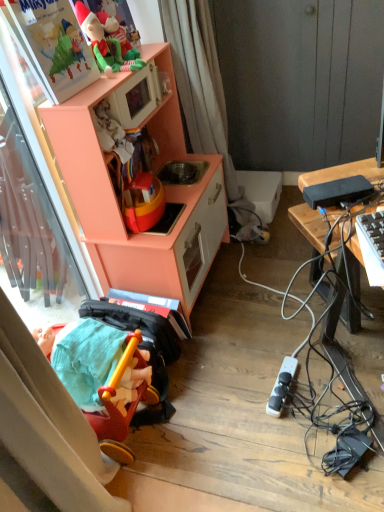
This screenshot has height=512, width=384. Describe the element at coordinates (199, 81) in the screenshot. I see `white fabric curtain at upper center` at that location.

Measure the distance between rubberized red tricycle at lower left, the 1th toy when ordered from bottom to top, and camera.

rubberized red tricycle at lower left, the 1th toy when ordered from bottom to top, is 3.82 feet away from camera.

The height and width of the screenshot is (512, 384). Describe the element at coordinates (118, 196) in the screenshot. I see `peach wood toy kitchen at left` at that location.

What is the approximate height of matte plastic elf at upper left, the 2th toy ordered from the bottom?

matte plastic elf at upper left, the 2th toy ordered from the bottom, is 14.09 inches in height.

You are a GUI agent. You are given a task and a screenshot of the screen. Output one action in this format:
    pyautogui.click(x=<x>, y=<y>)
    Task: Click on the white fabric curtain at upper center
    
    Given the screenshot: What is the action you would take?
    pyautogui.click(x=199, y=81)

Which of these two, rubberized red tricycle at lower left, the 2th toy viewed from the top, or black plastic desk at right, is wider?

Wider between the two is black plastic desk at right.

In terms of height, does rubberized red tricycle at lower left, the 1th toy when ordered from bottom to top, look taller or shorter compared to black plastic desk at right?

In the image, rubberized red tricycle at lower left, the 1th toy when ordered from bottom to top, appears to be taller than black plastic desk at right.

Find the location of a particular element. The image size is (384, 512). desk on the right of the rubberized red tricycle at lower left, the 2th toy viewed from the top is located at coordinates (337, 323).

In the scene shown: How many degrees apart are the facing directions of rubberized red tricycle at lower left, the 2th toy viewed from the top, and black plastic desk at right?

56.7 degrees.

In the scene shown: From a real-world perspective, between black plastic power strip at lower right, positioned as the 1th appliance in bottom-to-top order, and rubberized red tricycle at lower left, the 1th toy when ordered from bottom to top, who is vertically lower?

black plastic power strip at lower right, positioned as the 1th appliance in bottom-to-top order.

Is black plastic power strip at lower right, positioned as the 1th appliance in bottom-to-top order, not near rubberized red tricycle at lower left, the 1th toy when ordered from bottom to top?

That's not correct — black plastic power strip at lower right, positioned as the 1th appliance in bottom-to-top order, is a little close to rubberized red tricycle at lower left, the 1th toy when ordered from bottom to top.

Can you confirm if black plastic power strip at lower right, acting as the 2th appliance starting from the top, is wider than rubberized red tricycle at lower left, the 2th toy viewed from the top?

Incorrect, the width of black plastic power strip at lower right, acting as the 2th appliance starting from the top, does not surpass that of rubberized red tricycle at lower left, the 2th toy viewed from the top.

From the image's perspective, between black plastic power strip at lower right, acting as the 1th appliance starting from the back, and rubberized red tricycle at lower left, the 2th toy viewed from the top, which one is located above?

From the image's view, rubberized red tricycle at lower left, the 2th toy viewed from the top, is above.

Is peach wood toy kitchen at left bigger than black plastic desk at right?

Correct, peach wood toy kitchen at left is larger in size than black plastic desk at right.

Can you confirm if peach wood toy kitchen at left is wider than black plastic desk at right?

Yes, peach wood toy kitchen at left is wider than black plastic desk at right.

From the picture: From a real-world perspective, which object rests below the other?

black plastic desk at right.

Based on the photo, from the image's perspective, is peach wood toy kitchen at left above white fabric curtain at upper center?

No.

How much distance is there between peach wood toy kitchen at left and white fabric curtain at upper center?

They are 33.93 centimeters apart.

Between peach wood toy kitchen at left and white fabric curtain at upper center, which one has larger size?

With larger size is peach wood toy kitchen at left.

Which object is closer to the camera, peach wood toy kitchen at left or white fabric curtain at upper center?

peach wood toy kitchen at left is more forward.

Is black plastic desk at right not inside black plastic power strip at lower right, acting as the 2th appliance starting from the front?

Yes, black plastic desk at right is outside of black plastic power strip at lower right, acting as the 2th appliance starting from the front.

Can you confirm if black plastic desk at right is wider than black plastic power strip at lower right, positioned as the 1th appliance in bottom-to-top order?

Yes, black plastic desk at right is wider than black plastic power strip at lower right, positioned as the 1th appliance in bottom-to-top order.

Is black plastic desk at right at the left side of black plastic power strip at lower right, acting as the 2th appliance starting from the top?

Incorrect, black plastic desk at right is not on the left side of black plastic power strip at lower right, acting as the 2th appliance starting from the top.

From a real-world perspective, is black plastic desk at right positioned above or below black plastic power strip at lower right, positioned as the 1th appliance in bottom-to-top order?

black plastic desk at right is above black plastic power strip at lower right, positioned as the 1th appliance in bottom-to-top order.

From the picture: Is black plastic power strip at lower right, acting as the 1th appliance starting from the back, in contact with matte plastic elf at upper left, which is counted as the 1th toy, starting from the top?

No, black plastic power strip at lower right, acting as the 1th appliance starting from the back, is not in contact with matte plastic elf at upper left, which is counted as the 1th toy, starting from the top.

Is black plastic power strip at lower right, acting as the 2th appliance starting from the top, bigger than matte plastic elf at upper left, which is counted as the 1th toy, starting from the top?

No.

From the matte plastic elf at upper left, which is counted as the 1th toy, starting from the top, count 1st appliance to the right and point to it. Please provide its 2D coordinates.

[(282, 386)]

Is black plastic power strip at lower right, acting as the 2th appliance starting from the front, facing away from matte plastic elf at upper left, the 2th toy ordered from the bottom?

black plastic power strip at lower right, acting as the 2th appliance starting from the front, does not have its back to matte plastic elf at upper left, the 2th toy ordered from the bottom.

Who is more distant, black plastic power bank at right, the second appliance when ordered from back to front, or white fabric curtain at upper center?

white fabric curtain at upper center is further away from the camera.

This screenshot has width=384, height=512. What are the coordinates of `the 2nd appliance in front of the white fabric curtain at upper center` in the screenshot? It's located at (337, 192).

Could you measure the distance between black plastic power bank at right, the first appliance positioned from the front, and white fabric curtain at upper center?

The distance of black plastic power bank at right, the first appliance positioned from the front, from white fabric curtain at upper center is 91.49 centimeters.

At what (x,y) coordinates should I click in order to perform the action: click on desk that appears behind the rubberized red tricycle at lower left, the 1th toy when ordered from bottom to top. Please return your answer as a coordinate pair (x, y). The height and width of the screenshot is (512, 384). Looking at the image, I should click on (337, 323).

Image resolution: width=384 pixels, height=512 pixels. In order to click on the 1st toy counting from the left of the black plastic power strip at lower right, acting as the 2th appliance starting from the top in this screenshot , I will do `click(118, 408)`.

From the image, which object appears to be farther from white fabric curtain at upper center, matte plastic elf at upper left, which is counted as the 1th toy, starting from the top, or peach wood toy kitchen at left?

Among the two, matte plastic elf at upper left, which is counted as the 1th toy, starting from the top, is located further to white fabric curtain at upper center.

Considering their positions, is peach wood toy kitchen at left positioned further to white fabric curtain at upper center than rubberized red tricycle at lower left, the 1th toy when ordered from bottom to top?

rubberized red tricycle at lower left, the 1th toy when ordered from bottom to top, is further to white fabric curtain at upper center.

Which object lies nearer to the anchor point black plastic power bank at right, the first appliance positioned from the front, black plastic desk at right or black plastic power strip at lower right, acting as the 2th appliance starting from the top?

The object closer to black plastic power bank at right, the first appliance positioned from the front, is black plastic desk at right.

Based on their spatial positions, is black plastic desk at right or black plastic power bank at right, the second appliance when ordered from back to front, further from black plastic power strip at lower right, acting as the 2th appliance starting from the top?

Based on the image, black plastic power bank at right, the second appliance when ordered from back to front, appears to be further to black plastic power strip at lower right, acting as the 2th appliance starting from the top.

Looking at the image, which one is located further to matte plastic elf at upper left, the 2th toy ordered from the bottom, black plastic power strip at lower right, positioned as the 1th appliance in bottom-to-top order, or rubberized red tricycle at lower left, the 1th toy when ordered from bottom to top?

black plastic power strip at lower right, positioned as the 1th appliance in bottom-to-top order, is positioned further to the anchor matte plastic elf at upper left, the 2th toy ordered from the bottom.

From the image, which object appears to be farther from peach wood toy kitchen at left, black plastic power bank at right, the first appliance in the top-to-bottom sequence, or white fabric curtain at upper center?

black plastic power bank at right, the first appliance in the top-to-bottom sequence, is positioned further to the anchor peach wood toy kitchen at left.

When comparing their distances from matte plastic elf at upper left, which is counted as the 1th toy, starting from the top, does rubberized red tricycle at lower left, the 1th toy when ordered from bottom to top, or white fabric curtain at upper center seem further?

rubberized red tricycle at lower left, the 1th toy when ordered from bottom to top.

When comparing their distances from black plastic power strip at lower right, acting as the 1th appliance starting from the back, does black plastic desk at right or peach wood toy kitchen at left seem further?

The object further to black plastic power strip at lower right, acting as the 1th appliance starting from the back, is peach wood toy kitchen at left.

Where is `appliance that lies between white fabric curtain at upper center and rubberized red tricycle at lower left, the 1th toy when ordered from bottom to top, from top to bottom`? appliance that lies between white fabric curtain at upper center and rubberized red tricycle at lower left, the 1th toy when ordered from bottom to top, from top to bottom is located at coordinates (337, 192).

Find the location of a particular element. The height and width of the screenshot is (512, 384). curtain between matte plastic elf at upper left, the 2th toy ordered from the bottom, and black plastic power strip at lower right, acting as the 1th appliance starting from the back, from top to bottom is located at coordinates (199, 81).

Where is `appliance between matte plastic elf at upper left, the 2th toy ordered from the bottom, and black plastic power strip at lower right, acting as the 1th appliance starting from the back, in the vertical direction`? This screenshot has width=384, height=512. appliance between matte plastic elf at upper left, the 2th toy ordered from the bottom, and black plastic power strip at lower right, acting as the 1th appliance starting from the back, in the vertical direction is located at coordinates (337, 192).

At what (x,y) coordinates should I click in order to perform the action: click on toy that lies between peach wood toy kitchen at left and black plastic power strip at lower right, acting as the 2th appliance starting from the top, from top to bottom. Please return your answer as a coordinate pair (x, y). The image size is (384, 512). Looking at the image, I should click on (118, 408).